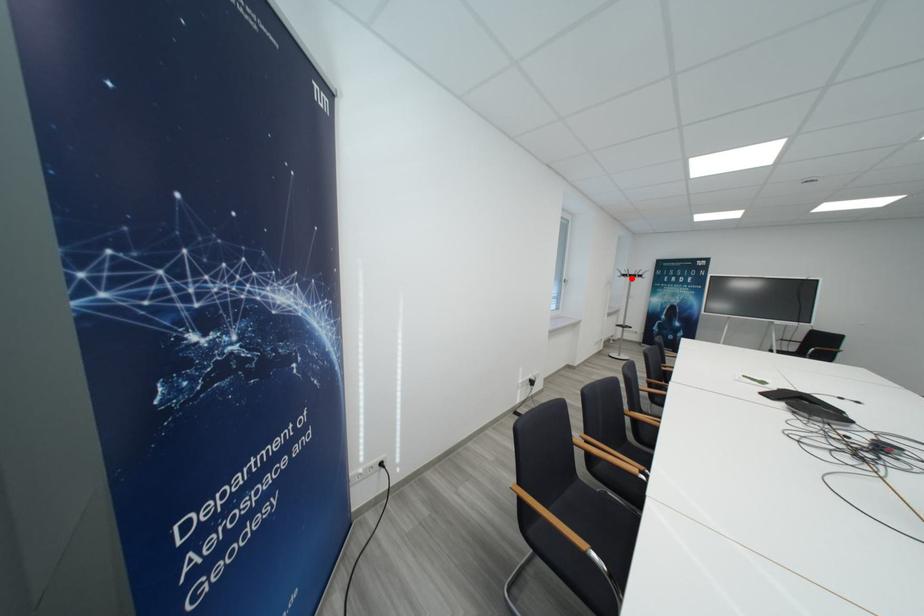
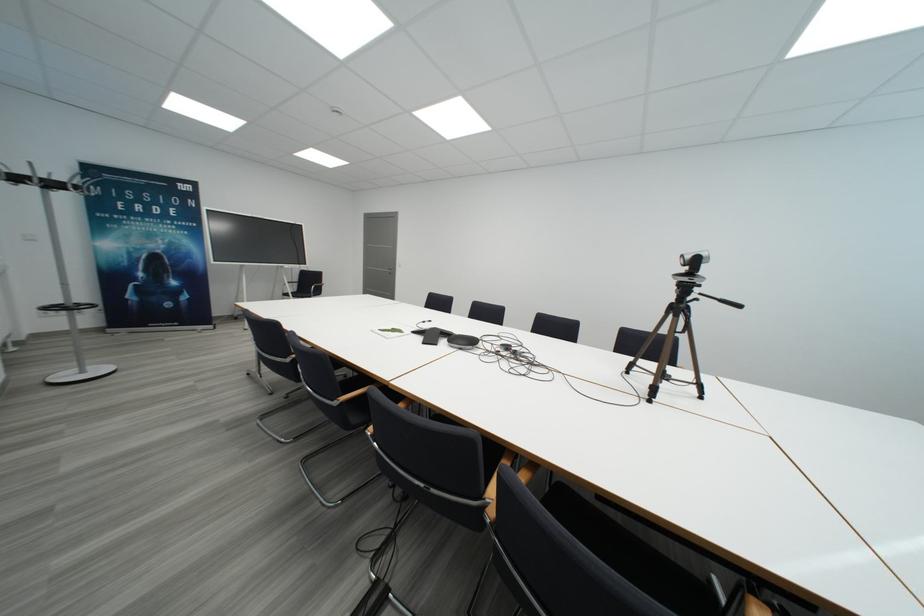
Question: I am providing you with two images of the same scene from different viewpoints. Given a red point in image1, look at the same physical point in image2. Is it:

Choices:
 (A) Closer to the viewpoint
 (B) Farther from the viewpoint

Answer: (A)